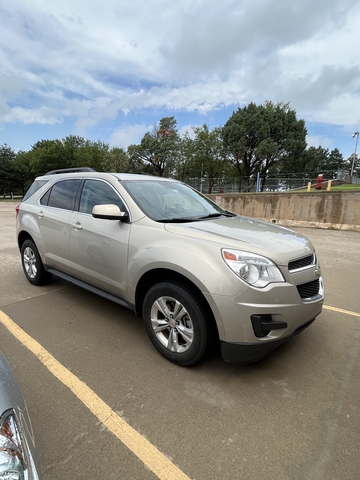
Find the location of a particular element. mirrror is located at coordinates (113, 208).